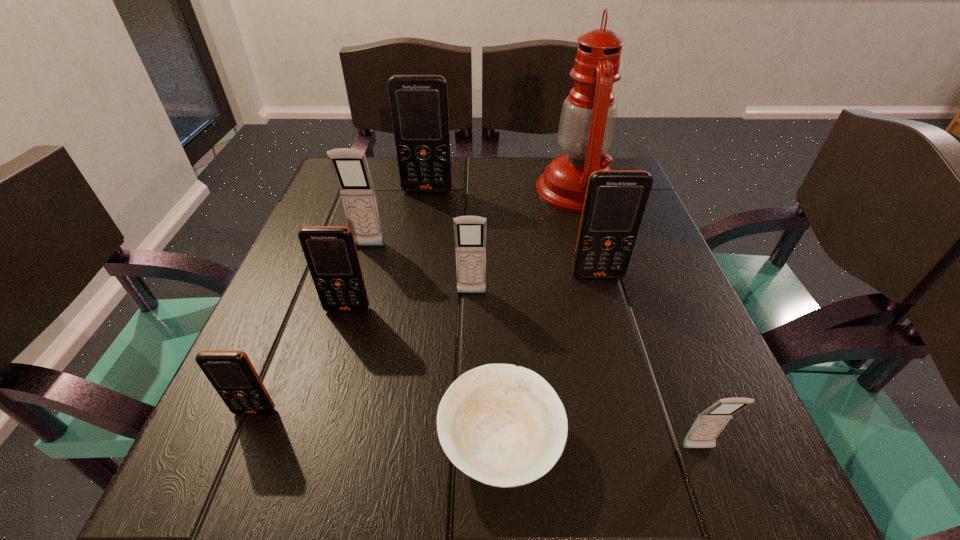
Where is `free space located on the screen of the rightmost orange cellular telephone`? This screenshot has height=540, width=960. free space located on the screen of the rightmost orange cellular telephone is located at coordinates (626, 374).

Identify the location of vacant space situated on the front-facing side of the second nearest gray cellular telephone. Image resolution: width=960 pixels, height=540 pixels. (469, 389).

I want to click on free location located 0.060m on the screen of the third farthest orange cellular telephone, so click(338, 341).

The image size is (960, 540). Identify the location of vacant area situated 0.100m on the screen of the second nearest cellular telephone. 224,488.

Find the location of a particular element. This screenshot has width=960, height=540. free point located 0.380m on the back of the beige bowl is located at coordinates (493, 235).

Where is `oil lamp that is at the far edge`? This screenshot has width=960, height=540. oil lamp that is at the far edge is located at coordinates (588, 117).

This screenshot has width=960, height=540. Find the location of `cellular telephone that is at the far edge`. cellular telephone that is at the far edge is located at coordinates (419, 103).

At what (x,y) coordinates should I click in order to perform the action: click on cellular telephone that is at the near edge. Please return your answer as a coordinate pair (x, y). This screenshot has width=960, height=540. Looking at the image, I should click on (709, 424).

This screenshot has height=540, width=960. I want to click on bowl that is at the near edge, so click(503, 425).

The image size is (960, 540). Identify the location of oil lamp present at the right edge. (588, 117).